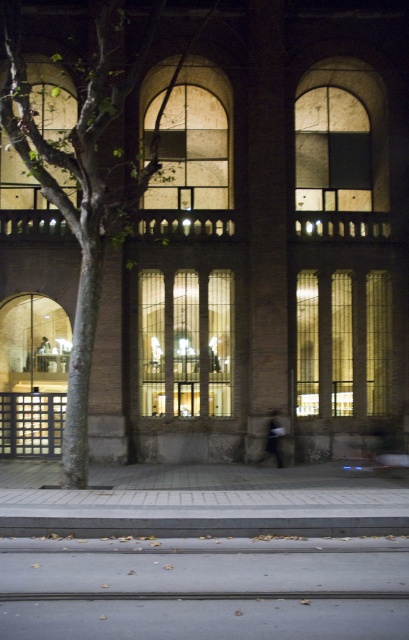
You are a delivery person trying to park your 1.2 meter wide delivery van on the gray concrete pavement at lower center. The curb next to it is the gray concrete curb at lower center. Can your van fit on the pavement without crossing over the curb?

The gray concrete pavement at lower center has a lesser height compared to the gray concrete curb at lower center. Since the pavement is lower, the van can park on it as long as it stays within the pavement area and doesn not cross the curb, which is higher and likely a boundary.

You are a delivery person trying to park your van in the paved area near the gray concrete curb at lower center. The van is 2 meters tall. Considering the green rough bark tree at left, will the tree block the van from entering the paved area?

The green rough bark tree at left is taller than the gray concrete curb at lower center, but since the tree is on the left side of the frame and the curb is at the lower center, the tree might not directly block the van from entering the paved area. However, the height difference could affect clearance if the van needs to pass under any branches. The description only mentions the tree is taller than the curb, so without knowing the exact height of the branches, it is uncertain if the van will fit. However,